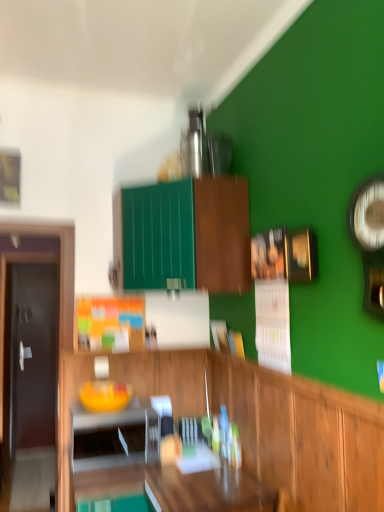
Question: In which direction should I rotate to look at green matte cabinet at upper center, marked as the first cabinetry in a top-to-bottom arrangement?

Choices:
 (A) left
 (B) right

Answer: (A)

Question: Is green matte cabinet at upper center, marked as the first cabinetry in a top-to-bottom arrangement, bigger than dark brown wooden door at left?

Choices:
 (A) no
 (B) yes

Answer: (B)

Question: Does green matte cabinet at upper center, marked as the first cabinetry in a top-to-bottom arrangement, come behind dark brown wooden door at left?

Choices:
 (A) yes
 (B) no

Answer: (B)

Question: Considering the relative sizes of green matte cabinet at upper center, the second cabinetry positioned from the bottom, and dark brown wooden door at left in the image provided, is green matte cabinet at upper center, the second cabinetry positioned from the bottom, taller than dark brown wooden door at left?

Choices:
 (A) no
 (B) yes

Answer: (A)

Question: From a real-world perspective, does green matte cabinet at upper center, the second cabinetry positioned from the bottom, sit lower than dark brown wooden door at left?

Choices:
 (A) yes
 (B) no

Answer: (B)

Question: Is green matte cabinet at upper center, the second cabinetry positioned from the bottom, facing away from dark brown wooden door at left?

Choices:
 (A) no
 (B) yes

Answer: (A)

Question: Considering the relative positions of green matte cabinet at upper center, marked as the first cabinetry in a top-to-bottom arrangement, and dark brown wooden door at left in the image provided, is green matte cabinet at upper center, marked as the first cabinetry in a top-to-bottom arrangement, to the left of dark brown wooden door at left from the viewer's perspective?

Choices:
 (A) no
 (B) yes

Answer: (A)

Question: From a real-world perspective, is wooden cabinet at center, the 2th cabinetry positioned from the top, located beneath metallic silver clock at right?

Choices:
 (A) no
 (B) yes

Answer: (B)

Question: Is wooden cabinet at center, the 2th cabinetry positioned from the top, touching metallic silver clock at right?

Choices:
 (A) yes
 (B) no

Answer: (B)

Question: From the image's perspective, is wooden cabinet at center, the 2th cabinetry positioned from the top, on top of metallic silver clock at right?

Choices:
 (A) yes
 (B) no

Answer: (B)

Question: Is metallic silver clock at right surrounded by wooden cabinet at center, the 2th cabinetry positioned from the top?

Choices:
 (A) yes
 (B) no

Answer: (B)

Question: From the image's perspective, is wooden cabinet at center, placed as the 1th cabinetry when sorted from bottom to top, beneath metallic silver clock at right?

Choices:
 (A) yes
 (B) no

Answer: (A)

Question: From a real-world perspective, is wooden cabinet at center, placed as the 1th cabinetry when sorted from bottom to top, on top of metallic silver clock at right?

Choices:
 (A) yes
 (B) no

Answer: (B)

Question: Is green matte cabinet at upper center, the second cabinetry positioned from the bottom, taller than white glossy microwave at lower left?

Choices:
 (A) yes
 (B) no

Answer: (A)